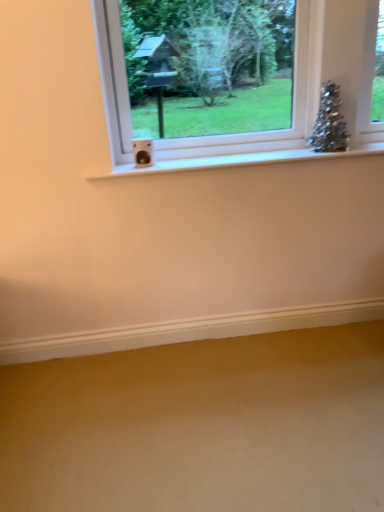
What is the approximate width of clear glass window at upper center?

24.52 centimeters.

Identify the location of clear glass window at upper center. (304, 90).

Describe the element at coordinates (304, 90) in the screenshot. The height and width of the screenshot is (512, 384). I see `clear glass window at upper center` at that location.

Describe the element at coordinates (329, 122) in the screenshot. I see `sparkly silver christmas tree at upper right` at that location.

The image size is (384, 512). Identify the location of sparkly silver christmas tree at upper right. (329, 122).

I want to click on clear glass window at upper center, so click(x=304, y=90).

Between sparkly silver christmas tree at upper right and clear glass window at upper center, which one appears on the right side from the viewer's perspective?

sparkly silver christmas tree at upper right is more to the right.

Which object is further away from the camera taking this photo, sparkly silver christmas tree at upper right or clear glass window at upper center?

sparkly silver christmas tree at upper right is further away from the camera.

Between point (325, 102) and point (112, 86), which one is positioned in front?

The point (112, 86) is more forward.

From the image's perspective, who appears lower, sparkly silver christmas tree at upper right or clear glass window at upper center?

sparkly silver christmas tree at upper right appears lower in the image.

From a real-world perspective, which is physically above, sparkly silver christmas tree at upper right or clear glass window at upper center?

clear glass window at upper center, from a real-world perspective.

Between sparkly silver christmas tree at upper right and clear glass window at upper center, which one has larger width?

Wider between the two is clear glass window at upper center.

In the scene shown: From their relative heights in the image, would you say sparkly silver christmas tree at upper right is taller or shorter than clear glass window at upper center?

In the image, sparkly silver christmas tree at upper right appears to be shorter than clear glass window at upper center.

Is sparkly silver christmas tree at upper right smaller than clear glass window at upper center?

Yes, sparkly silver christmas tree at upper right is smaller than clear glass window at upper center.

Is clear glass window at upper center a part of sparkly silver christmas tree at upper right?

No, sparkly silver christmas tree at upper right does not contain clear glass window at upper center.

Does sparkly silver christmas tree at upper right touch clear glass window at upper center?

There is a gap between sparkly silver christmas tree at upper right and clear glass window at upper center.

Could you tell me if sparkly silver christmas tree at upper right is turned towards clear glass window at upper center?

No, sparkly silver christmas tree at upper right is not facing towards clear glass window at upper center.

How many degrees apart are the facing directions of sparkly silver christmas tree at upper right and clear glass window at upper center?

The angular difference between sparkly silver christmas tree at upper right and clear glass window at upper center is 0.846 degrees.

Measure the distance from sparkly silver christmas tree at upper right to clear glass window at upper center.

The distance of sparkly silver christmas tree at upper right from clear glass window at upper center is 10.38 inches.

Find the location of a particular element. christmas tree below the clear glass window at upper center (from the image's perspective) is located at coordinates (329, 122).

Would you say clear glass window at upper center is to the left or to the right of sparkly silver christmas tree at upper right in the picture?

clear glass window at upper center is to the left of sparkly silver christmas tree at upper right.

Which object is more forward, clear glass window at upper center or sparkly silver christmas tree at upper right?

Positioned in front is clear glass window at upper center.

Is point (310, 40) positioned in front of point (336, 112)?

Yes, point (310, 40) is in front of point (336, 112).

Based on the photo, from the image's perspective, is clear glass window at upper center above or below sparkly silver christmas tree at upper right?

Based on their image positions, clear glass window at upper center is located above sparkly silver christmas tree at upper right.

From a real-world perspective, is clear glass window at upper center positioned over sparkly silver christmas tree at upper right based on gravity?

Yes.

Can you confirm if clear glass window at upper center is thinner than sparkly silver christmas tree at upper right?

No.

Considering the relative sizes of clear glass window at upper center and sparkly silver christmas tree at upper right in the image provided, is clear glass window at upper center taller than sparkly silver christmas tree at upper right?

Correct, clear glass window at upper center is much taller as sparkly silver christmas tree at upper right.

Considering the relative sizes of clear glass window at upper center and sparkly silver christmas tree at upper right in the image provided, is clear glass window at upper center smaller than sparkly silver christmas tree at upper right?

Incorrect, clear glass window at upper center is not smaller in size than sparkly silver christmas tree at upper right.

Is clear glass window at upper center positioned beyond the bounds of sparkly silver christmas tree at upper right?

Yes, clear glass window at upper center is not within sparkly silver christmas tree at upper right.

Is clear glass window at upper center placed right next to sparkly silver christmas tree at upper right?

No, clear glass window at upper center is not touching sparkly silver christmas tree at upper right.

Is sparkly silver christmas tree at upper right at the back of clear glass window at upper center?

Yes, clear glass window at upper center is facing away from sparkly silver christmas tree at upper right.

How different are the orientations of clear glass window at upper center and sparkly silver christmas tree at upper right in degrees?

There is a 0.846-degree angle between the facing directions of clear glass window at upper center and sparkly silver christmas tree at upper right.

At what (x,y) coordinates should I click in order to perform the action: click on window on the left of sparkly silver christmas tree at upper right. Please return your answer as a coordinate pair (x, y). Looking at the image, I should click on (304, 90).

Find the location of a particular element. window in front of the sparkly silver christmas tree at upper right is located at coordinates (304, 90).

The width and height of the screenshot is (384, 512). I want to click on christmas tree below the clear glass window at upper center (from the image's perspective), so click(x=329, y=122).